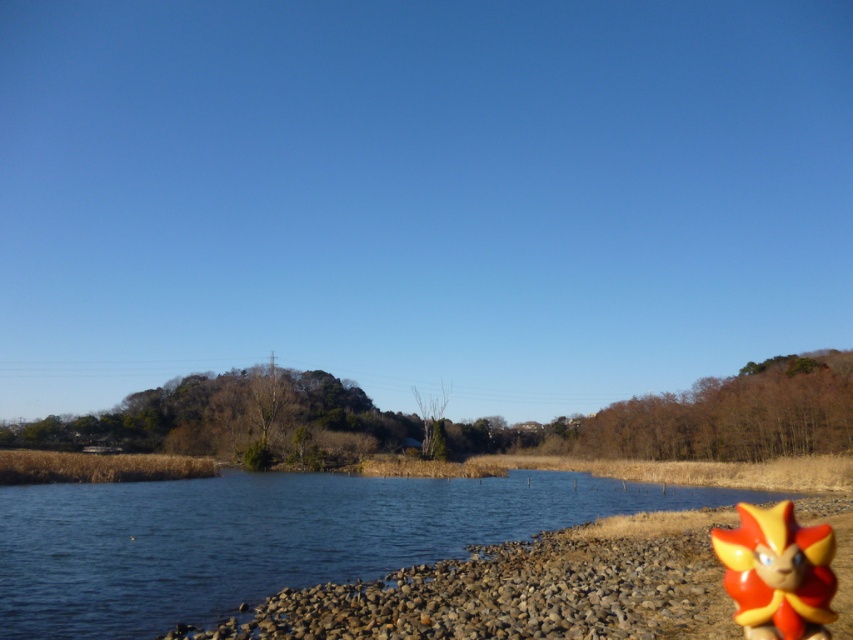
Between blue water at lower left and shiny plastic toy at lower right, which one appears on the left side from the viewer's perspective?

Positioned to the left is blue water at lower left.

Looking at this image, is blue water at lower left positioned at the back of shiny plastic toy at lower right?

Yes.

Identify the location of blue water at lower left. (264, 538).